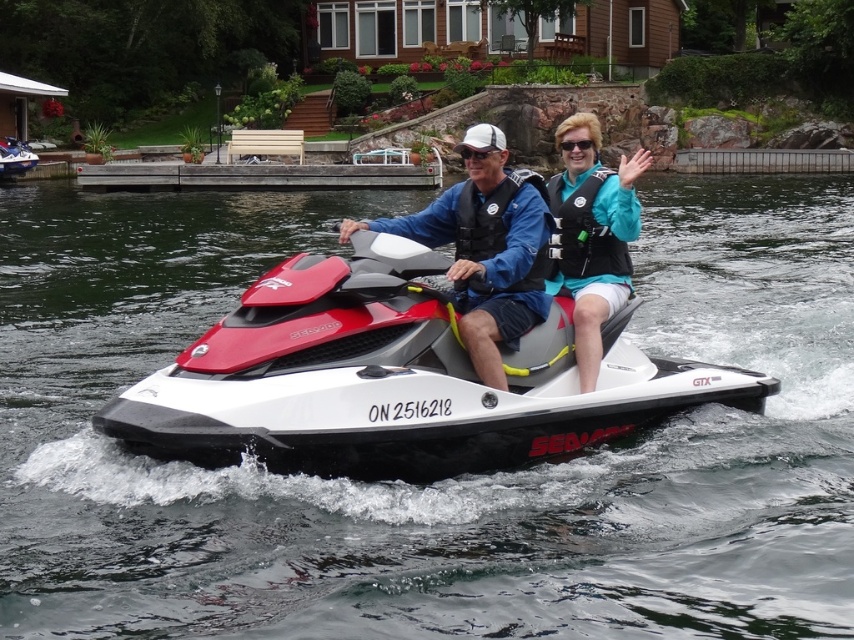
Does black fabric life jacket at center appear on the right side of black matte goggles at center?

Correct, you'll find black fabric life jacket at center to the right of black matte goggles at center.

Is the position of black fabric life jacket at center more distant than that of black matte goggles at center?

No, it is not.

Between point (471, 282) and point (471, 156), which one is positioned behind?

The point (471, 156) is more distant.

Identify the location of black fabric life jacket at center. (490, 214).

Who is positioned more to the right, red matte jet ski at center or teal fabric life vest at upper right?

Positioned to the right is teal fabric life vest at upper right.

What do you see at coordinates (395, 380) in the screenshot? This screenshot has height=640, width=854. I see `red matte jet ski at center` at bounding box center [395, 380].

Image resolution: width=854 pixels, height=640 pixels. I want to click on red matte jet ski at center, so [x=395, y=380].

Can you confirm if teal fabric life jacket at upper right is thinner than black matte goggles at center?

Correct, teal fabric life jacket at upper right's width is less than black matte goggles at center's.

Does teal fabric life jacket at upper right appear under black matte goggles at center?

Indeed, teal fabric life jacket at upper right is positioned under black matte goggles at center.

Which is in front, point (585, 232) or point (469, 150)?

Point (469, 150) is in front.

Where is `teal fabric life jacket at upper right`? teal fabric life jacket at upper right is located at coordinates (583, 232).